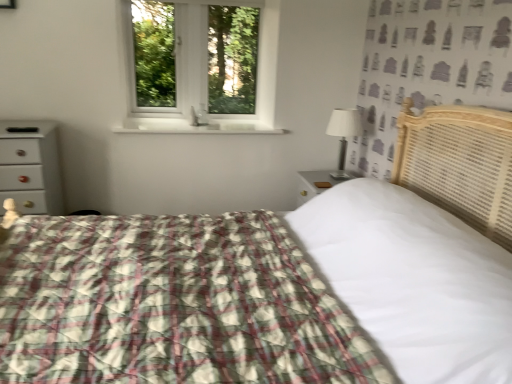
Question: Can you confirm if white fabric-covered lamp at right is taller than plaid fabric bed at center?

Choices:
 (A) no
 (B) yes

Answer: (A)

Question: Is white fabric-covered lamp at right smaller than plaid fabric bed at center?

Choices:
 (A) yes
 (B) no

Answer: (A)

Question: Is plaid fabric bed at center at the back of white fabric-covered lamp at right?

Choices:
 (A) no
 (B) yes

Answer: (A)

Question: Would you consider white fabric-covered lamp at right to be distant from plaid fabric bed at center?

Choices:
 (A) no
 (B) yes

Answer: (B)

Question: Does white fabric-covered lamp at right contain plaid fabric bed at center?

Choices:
 (A) no
 (B) yes

Answer: (A)

Question: In the image, is white glossy window sill at center on the left side or the right side of white plastic window at upper center?

Choices:
 (A) right
 (B) left

Answer: (A)

Question: In terms of height, does white glossy window sill at center look taller or shorter compared to white plastic window at upper center?

Choices:
 (A) short
 (B) tall

Answer: (A)

Question: Is white glossy window sill at center spatially inside white plastic window at upper center, or outside of it?

Choices:
 (A) outside
 (B) inside

Answer: (A)

Question: Is point (129, 122) closer or farther from the camera than point (190, 36)?

Choices:
 (A) farther
 (B) closer

Answer: (B)

Question: In terms of width, does white glossy chest of drawers at left look wider or thinner when compared to white fabric-covered lamp at right?

Choices:
 (A) thin
 (B) wide

Answer: (B)

Question: Is point (38, 213) positioned closer to the camera than point (340, 157)?

Choices:
 (A) closer
 (B) farther

Answer: (A)

Question: Considering the positions of white glossy chest of drawers at left and white fabric-covered lamp at right in the image, is white glossy chest of drawers at left taller or shorter than white fabric-covered lamp at right?

Choices:
 (A) short
 (B) tall

Answer: (B)

Question: From the image's perspective, is white glossy chest of drawers at left above or below white fabric-covered lamp at right?

Choices:
 (A) below
 (B) above

Answer: (A)

Question: Looking at their shapes, would you say white glossy chest of drawers at left is wider or thinner than white plastic window at upper center?

Choices:
 (A) thin
 (B) wide

Answer: (B)

Question: Is white glossy chest of drawers at left inside or outside of white plastic window at upper center?

Choices:
 (A) inside
 (B) outside

Answer: (B)